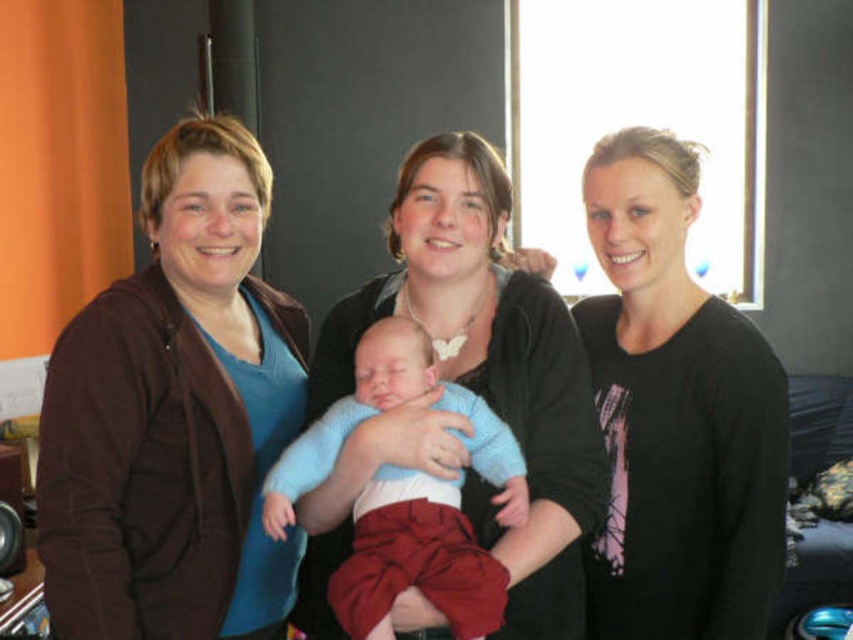
In the scene shown: Does brown fleece jacket at left appear on the right side of knitted blue sweater at center?

In fact, brown fleece jacket at left is to the left of knitted blue sweater at center.

Which is more to the right, brown fleece jacket at left or knitted blue sweater at center?

From the viewer's perspective, knitted blue sweater at center appears more on the right side.

Who is more distant from viewer, (x=71, y=410) or (x=459, y=624)?

The point (x=71, y=410) is more distant.

The image size is (853, 640). Identify the location of brown fleece jacket at left. (175, 416).

Which is more to the right, matte black sweater at center or knitted blue sweater at center?

matte black sweater at center is more to the right.

Can you confirm if matte black sweater at center is positioned above knitted blue sweater at center?

Yes, matte black sweater at center is above knitted blue sweater at center.

Who is more forward, (340,452) or (433,541)?

Point (433,541) is more forward.

You are a GUI agent. You are given a task and a screenshot of the screen. Output one action in this format:
    pyautogui.click(x=<x>, y=<y>)
    Task: Click on the matte black sweater at center
    
    Given the screenshot: What is the action you would take?
    pyautogui.click(x=489, y=368)

Does point (149, 298) come farther from viewer compared to point (668, 589)?

No.

Is brown fleece jacket at left behind black matte shirt at center?

No, brown fleece jacket at left is closer to the viewer.

This screenshot has width=853, height=640. What do you see at coordinates (175, 416) in the screenshot? I see `brown fleece jacket at left` at bounding box center [175, 416].

Identify the location of brown fleece jacket at left. (175, 416).